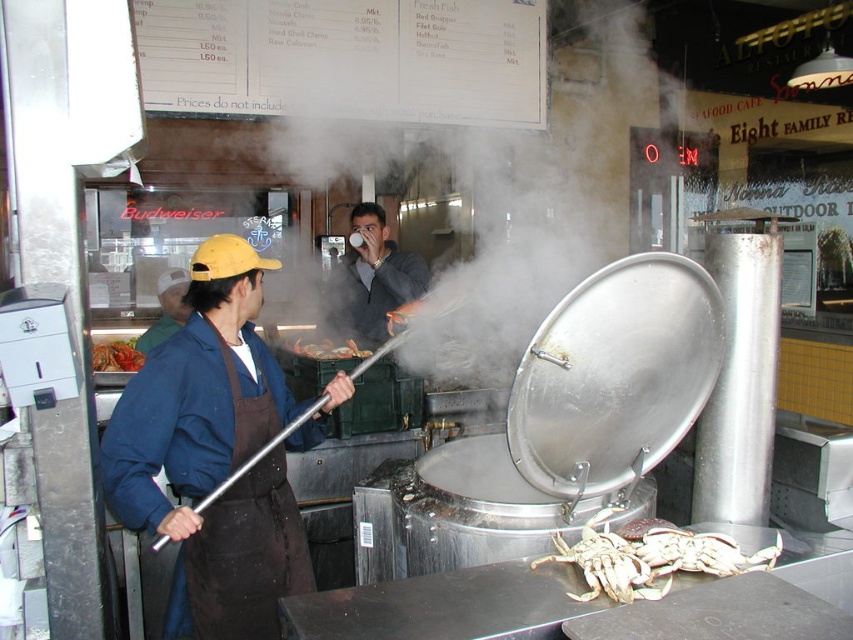
Between point (364, 342) and point (161, 339), which one is positioned behind?

The point (364, 342) is more distant.

Can you confirm if matte gray sweater at center is wider than brown apron at left?

Indeed, matte gray sweater at center has a greater width compared to brown apron at left.

Between point (397, 291) and point (178, 284), which one is positioned behind?

Positioned behind is point (397, 291).

You are a GUI agent. You are given a task and a screenshot of the screen. Output one action in this format:
    pyautogui.click(x=<x>, y=<y>)
    Task: Click on the matte gray sweater at center
    This screenshot has height=640, width=853.
    Given the screenshot: What is the action you would take?
    pyautogui.click(x=370, y=280)

Is point (515, 230) positioned in front of point (126, 365)?

That is False.

Does point (558, 284) come in front of point (96, 368)?

No, it is behind (96, 368).

This screenshot has width=853, height=640. Identify the location of white vapor at center. (555, 182).

Between matte gray sweater at center and shiny silver crab at center, which one is positioned higher?

matte gray sweater at center

You are a GUI agent. You are given a task and a screenshot of the screen. Output one action in this format:
    pyautogui.click(x=<x>, y=<y>)
    Task: Click on the matte gray sweater at center
    
    Given the screenshot: What is the action you would take?
    pyautogui.click(x=370, y=280)

This screenshot has width=853, height=640. What are the coordinates of `matte gray sweater at center` in the screenshot? It's located at (370, 280).